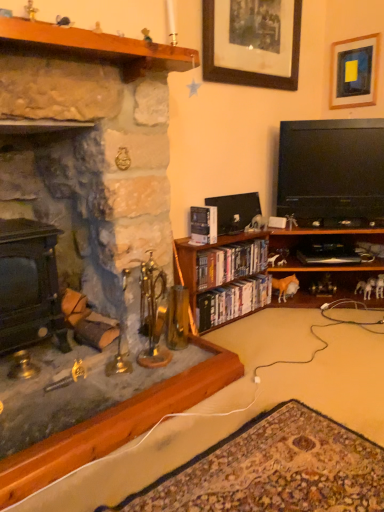
Identify the location of unoccupied area in front of hardcover books at center, arranged as the third book when viewed from the top. (254, 345).